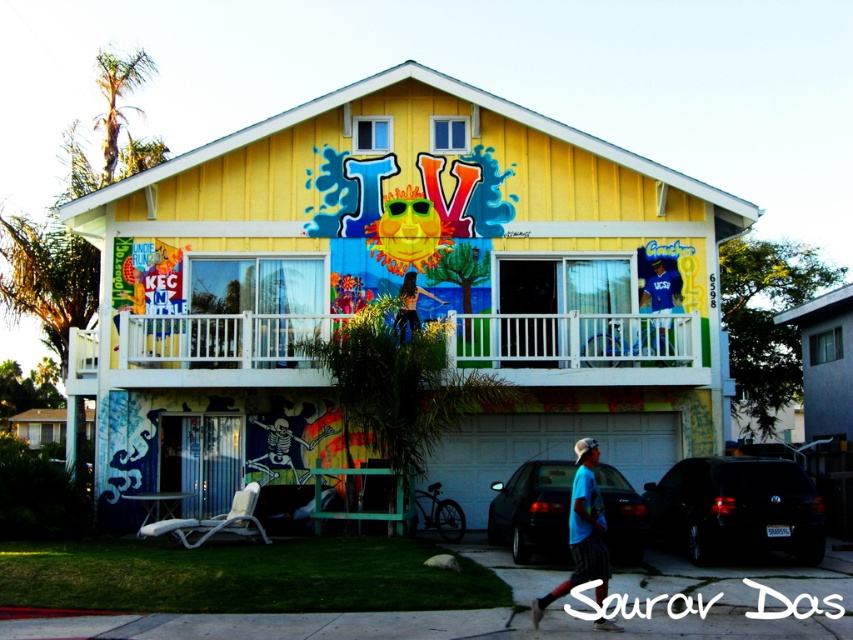
Question: Which is farther from the black matte suv at lower right?

Choices:
 (A) matte black sedan at lower center
 (B) matte black pants at center

Answer: (B)

Question: Where is matte black sedan at lower center located in relation to blue t-shirt at lower right in the image?

Choices:
 (A) below
 (B) above

Answer: (A)

Question: Which object is positioned farthest from the white plastic railing at upper center?

Choices:
 (A) matte black sedan at lower center
 (B) matte black pants at center
 (C) black matte suv at lower right
 (D) blue t-shirt at lower right

Answer: (D)

Question: From the image, what is the correct spatial relationship of white plastic railing at upper center in relation to matte black sedan at lower center?

Choices:
 (A) left
 (B) right

Answer: (A)

Question: Among these points, which one is nearest to the camera?

Choices:
 (A) (418, 285)
 (B) (581, 572)
 (C) (80, 356)
 (D) (770, 493)

Answer: (B)

Question: Can you confirm if black matte suv at lower right is positioned above matte black pants at center?

Choices:
 (A) yes
 (B) no

Answer: (B)